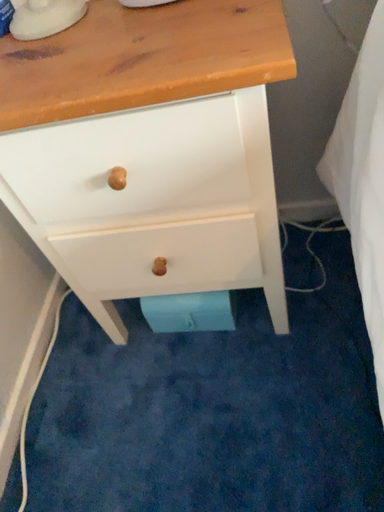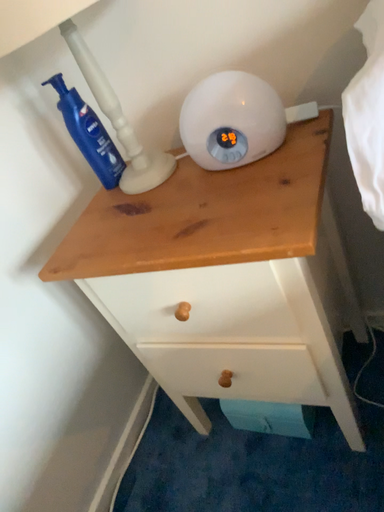
Question: How did the camera likely rotate when shooting the video?

Choices:
 (A) rotated upward
 (B) rotated downward

Answer: (A)